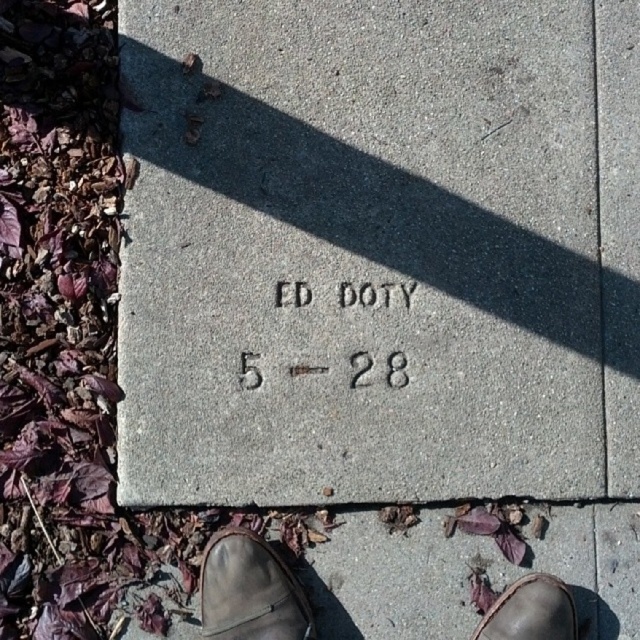
You are a photographer trying to capture both the leather boot at lower center and the brown leather shoe at lower center in a single frame. Given their sizes, which object should you position closer to the camera to ensure both appear equally sized in the photo?

Since the leather boot at lower center is bigger than the brown leather shoe at lower center, you should position the brown leather shoe at lower center closer to the camera to make them appear the same size in the photo.

You are standing on the sidewalk and want to place a new flower pot exactly where the gray concrete marker at center is located. Since the marker is already there, can you tell me the exact coordinates where you should place the flower pot?

The gray concrete marker at center is located at coordinates point (x=380, y=250), so you should place the flower pot there.